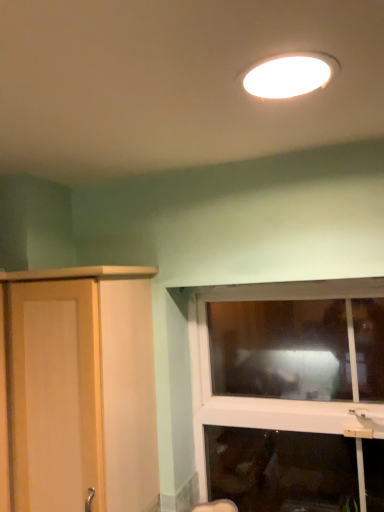
Question: Considering the relative sizes of transparent glass window at lower right and white glossy light fixture at upper center in the image provided, is transparent glass window at lower right taller than white glossy light fixture at upper center?

Choices:
 (A) no
 (B) yes

Answer: (B)

Question: From a real-world perspective, is transparent glass window at lower right physically below white glossy light fixture at upper center?

Choices:
 (A) yes
 (B) no

Answer: (A)

Question: From the image's perspective, is transparent glass window at lower right located above white glossy light fixture at upper center?

Choices:
 (A) yes
 (B) no

Answer: (B)

Question: Does transparent glass window at lower right have a larger size compared to white glossy light fixture at upper center?

Choices:
 (A) no
 (B) yes

Answer: (B)

Question: Is transparent glass window at lower right touching white glossy light fixture at upper center?

Choices:
 (A) yes
 (B) no

Answer: (B)

Question: Is transparent glass window at lower right positioned with its back to white glossy light fixture at upper center?

Choices:
 (A) yes
 (B) no

Answer: (B)

Question: Are white glossy light fixture at upper center and light wood cupboard at left located far from each other?

Choices:
 (A) yes
 (B) no

Answer: (B)

Question: Does white glossy light fixture at upper center have a greater height compared to light wood cupboard at left?

Choices:
 (A) yes
 (B) no

Answer: (B)

Question: Can you confirm if white glossy light fixture at upper center is positioned to the left of light wood cupboard at left?

Choices:
 (A) no
 (B) yes

Answer: (A)

Question: Considering the relative sizes of white glossy light fixture at upper center and light wood cupboard at left in the image provided, is white glossy light fixture at upper center bigger than light wood cupboard at left?

Choices:
 (A) yes
 (B) no

Answer: (B)

Question: From the image's perspective, would you say white glossy light fixture at upper center is positioned over light wood cupboard at left?

Choices:
 (A) no
 (B) yes

Answer: (B)

Question: Is white glossy light fixture at upper center located outside light wood cupboard at left?

Choices:
 (A) yes
 (B) no

Answer: (A)

Question: Does light wood cupboard at left have a smaller size compared to transparent glass window at lower right?

Choices:
 (A) no
 (B) yes

Answer: (A)